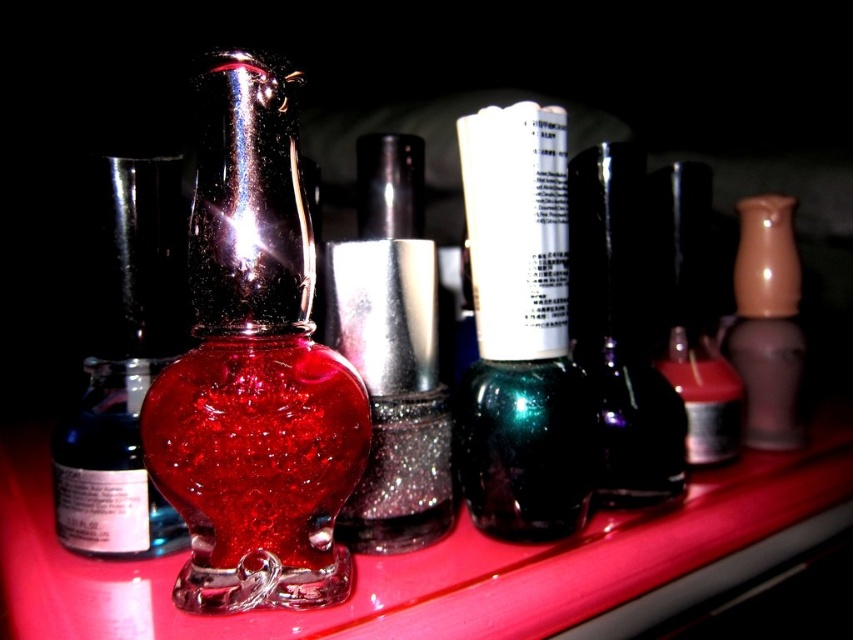
You have two nail polish bottles in front of you, the sparkling glass bottle at center and the matte black nail polish at center. Which one is taller?

The sparkling glass bottle at center is much taller than the matte black nail polish at center.

You are a customer trying to pick a nail polish bottle. You notice the shiny glass bottle at center and the matte black nail polish at center. Which one do you think is easier to see the reflection on?

The shiny glass bottle at center is closer to the viewer than the matte black nail polish at center, so its reflection would be more prominent and easier to see.